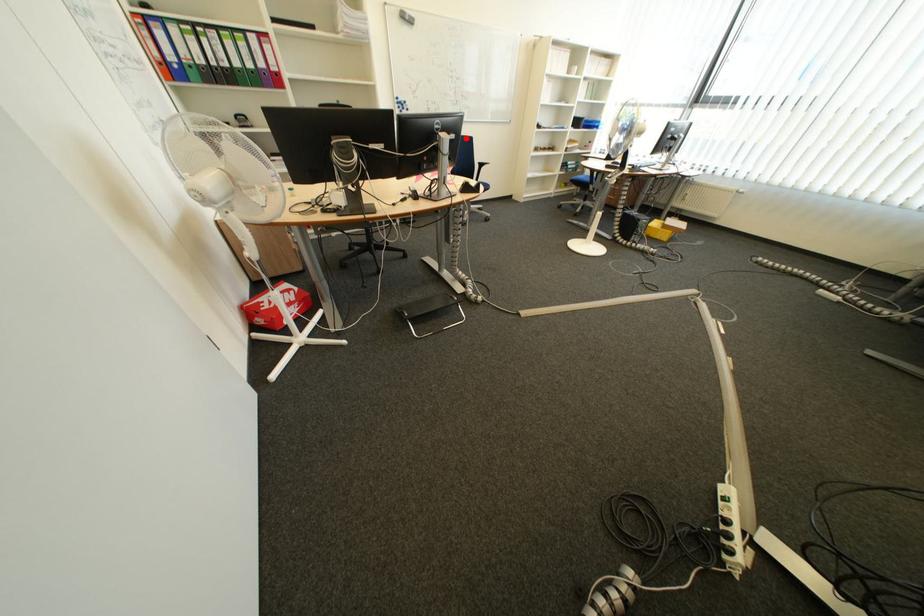
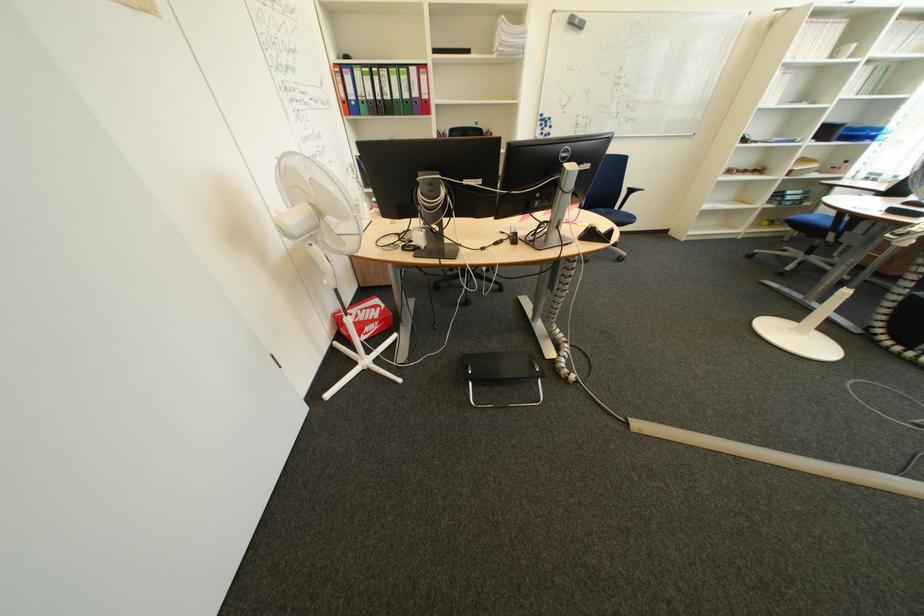
In the second image, find the point that corresponds to the highlighted location in the first image.

(601, 168)